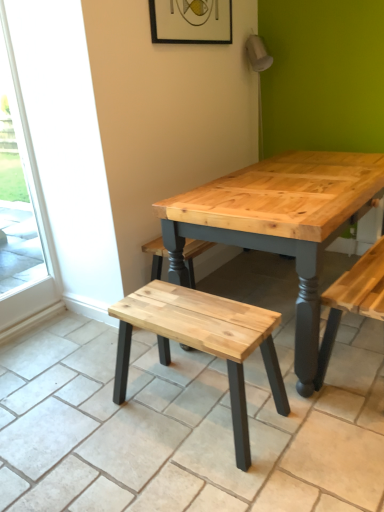
Locate an element on the screen. vacant area that is situated to the right of natural wood stool at center is located at coordinates (316, 408).